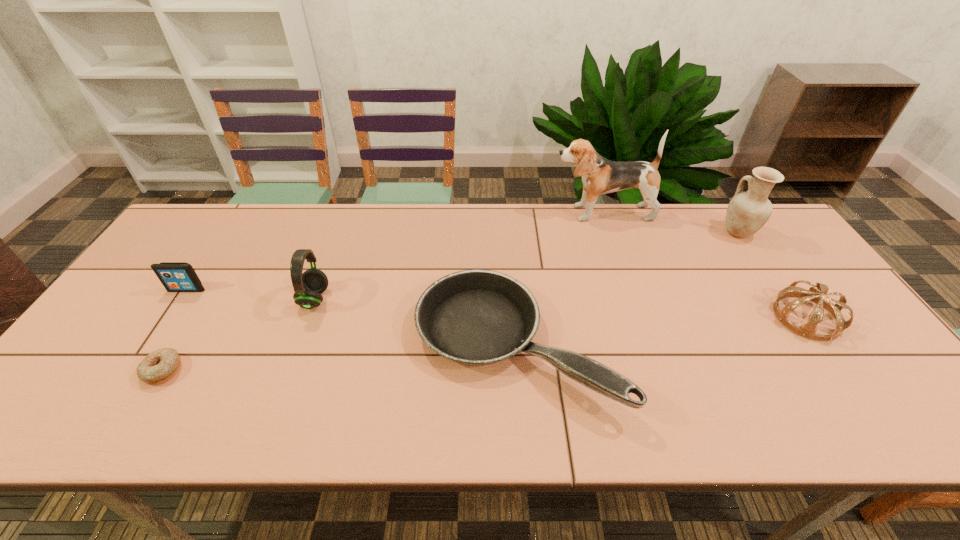
Where is `object present at the left edge`? This screenshot has width=960, height=540. object present at the left edge is located at coordinates (175, 276).

Where is `pottery at the right edge`? This screenshot has width=960, height=540. pottery at the right edge is located at coordinates (747, 212).

Find the location of a particular element. This screenshot has width=960, height=540. tiara present at the right edge is located at coordinates (808, 330).

Locate an element on the screen. object situated at the far right corner is located at coordinates (747, 212).

This screenshot has height=540, width=960. I want to click on vacant area at the far edge, so (x=259, y=210).

The image size is (960, 540). In the image, there is a desktop. Find the location of `vacant space at the near edge`. vacant space at the near edge is located at coordinates (269, 431).

Where is `vacant space at the left edge of the desktop`? This screenshot has width=960, height=540. vacant space at the left edge of the desktop is located at coordinates (108, 397).

This screenshot has height=540, width=960. What are the coordinates of `free space at the near left corner of the desktop` in the screenshot? It's located at (69, 399).

The width and height of the screenshot is (960, 540). Identify the location of vacant point located between the tiara and the third object from left to right. (561, 308).

This screenshot has width=960, height=540. I want to click on vacant area between the frying pan and the second tallest object, so click(627, 288).